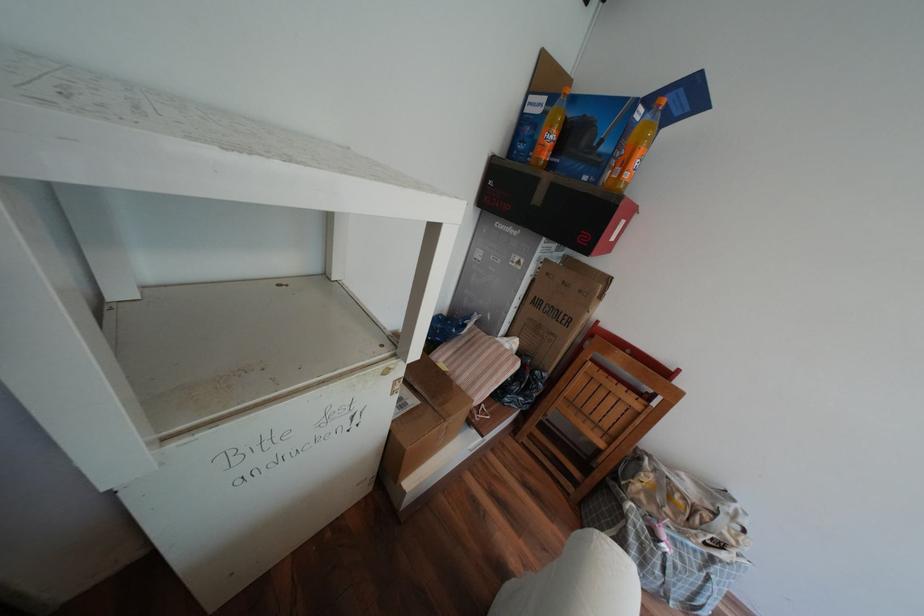
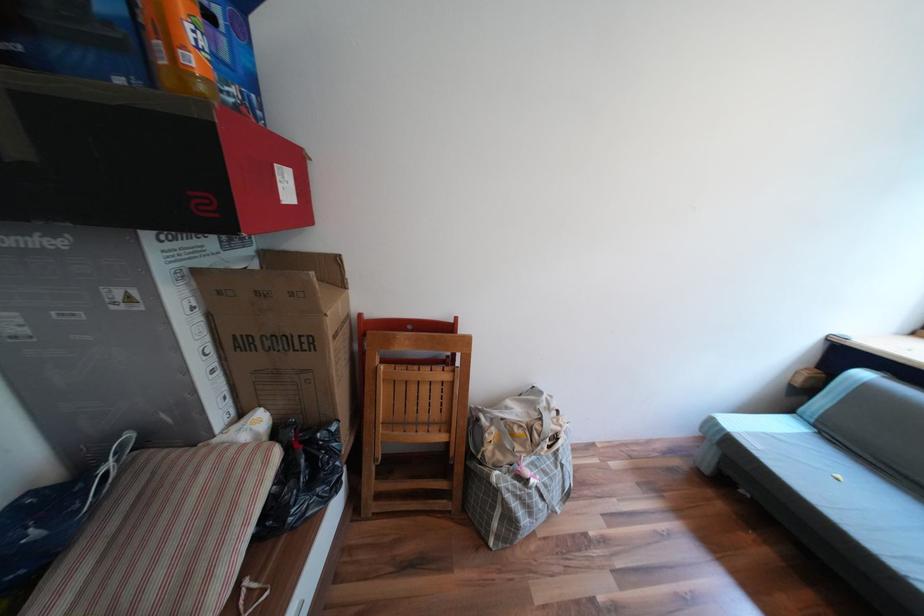
In the second image, find the point that corresponds to point 545,371 in the first image.

(327, 435)